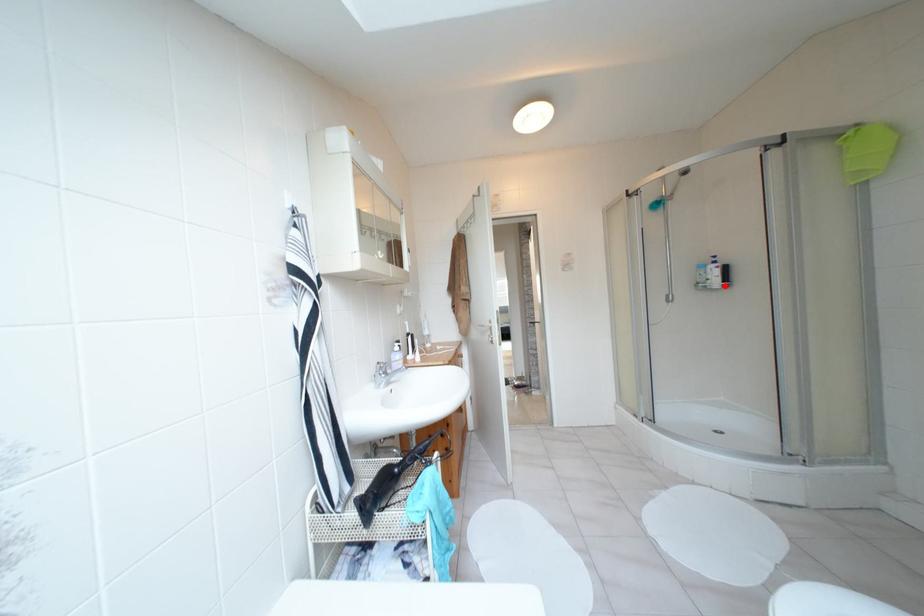
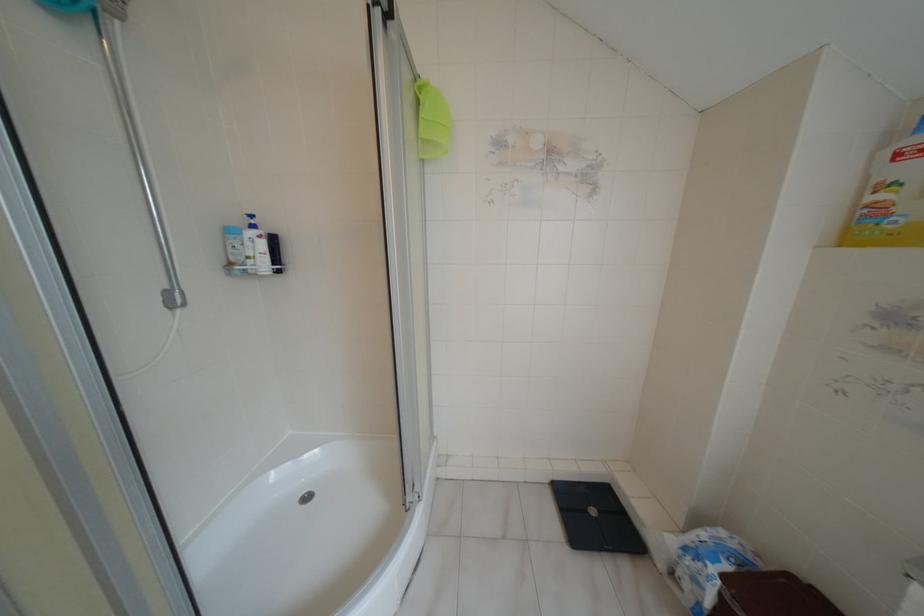
Locate, in the second image, the point that corresponds to the highlighted location in the first image.

(277, 270)